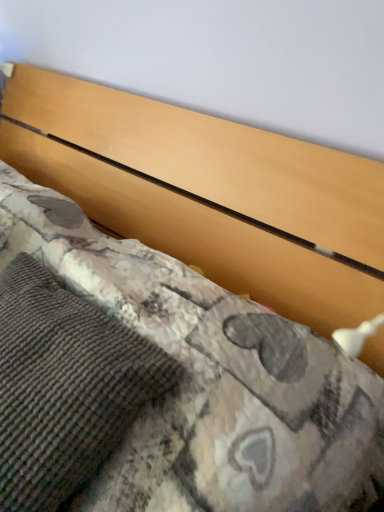
I want to click on fluffy fabric throw pillow at lower left, so click(65, 386).

Describe the element at coordinates (65, 386) in the screenshot. I see `fluffy fabric throw pillow at lower left` at that location.

Where is `fluffy fabric throw pillow at lower left`? The image size is (384, 512). fluffy fabric throw pillow at lower left is located at coordinates (65, 386).